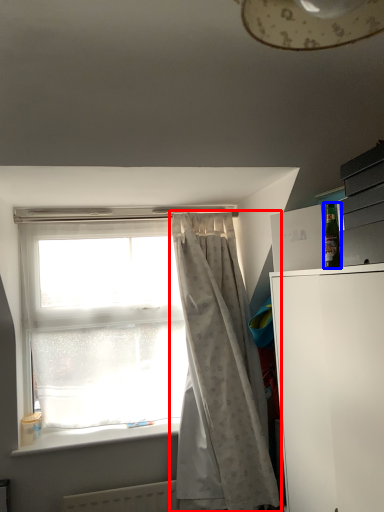
Question: Which point is further to the camera, curtain (highlighted by a red box) or bottle (highlighted by a blue box)?

Choices:
 (A) curtain
 (B) bottle

Answer: (A)